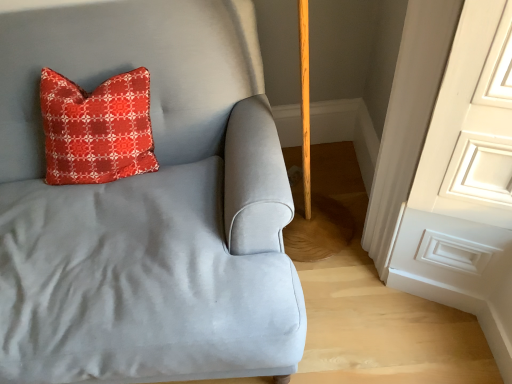
Locate an element on the screen. The height and width of the screenshot is (384, 512). satin gray armchair at upper left is located at coordinates (147, 206).

This screenshot has height=384, width=512. What do you see at coordinates (147, 206) in the screenshot?
I see `satin gray armchair at upper left` at bounding box center [147, 206].

Where is `satin gray armchair at upper left`? The width and height of the screenshot is (512, 384). satin gray armchair at upper left is located at coordinates (147, 206).